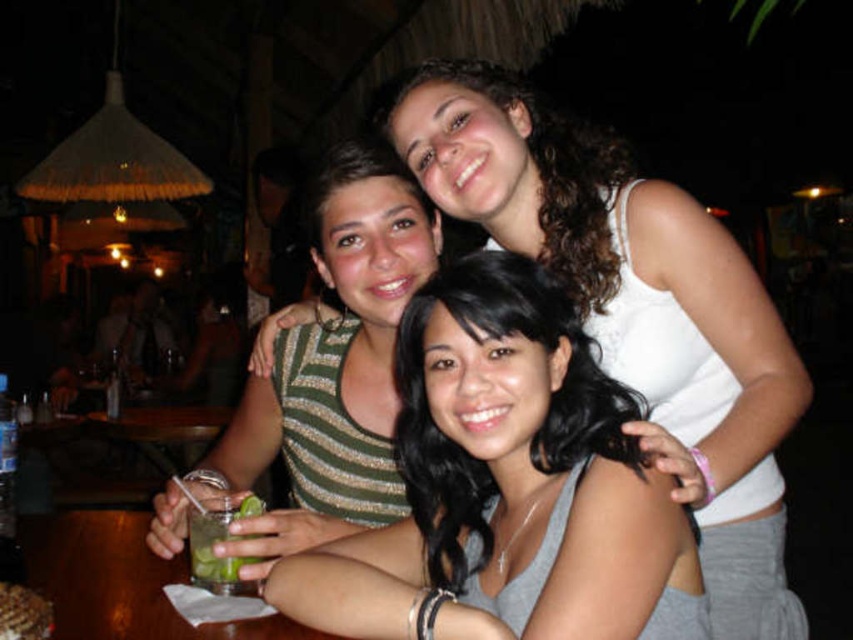
Question: Considering the real-world distances, which object is farthest from the green leafy drink at center?

Choices:
 (A) green striped shirt at center
 (B) gray matte tank top at center

Answer: (B)

Question: Does green striped shirt at center come in front of green leafy drink at center?

Choices:
 (A) yes
 (B) no

Answer: (A)

Question: Estimate the real-world distances between objects in this image. Which object is closer to the green striped shirt at center?

Choices:
 (A) gray matte tank top at center
 (B) green leafy drink at center

Answer: (B)

Question: Can you confirm if gray matte tank top at center is positioned above green leafy drink at center?

Choices:
 (A) no
 (B) yes

Answer: (B)

Question: Is gray matte tank top at center to the left of green striped shirt at center from the viewer's perspective?

Choices:
 (A) no
 (B) yes

Answer: (A)

Question: Estimate the real-world distances between objects in this image. Which object is closer to the gray matte tank top at center?

Choices:
 (A) green leafy drink at center
 (B) green striped shirt at center

Answer: (B)